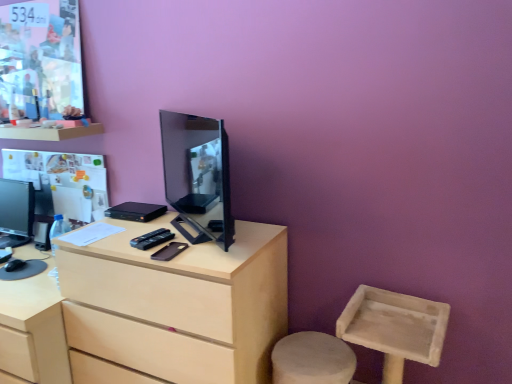
Question: Can you confirm if matte black tv at center, the second television when ordered from left to right, is thinner than black matte mobile phone at center?

Choices:
 (A) no
 (B) yes

Answer: (B)

Question: Does matte black tv at center, which is the first television in right-to-left order, have a larger size compared to black matte mobile phone at center?

Choices:
 (A) yes
 (B) no

Answer: (A)

Question: Is matte black tv at center, the second television when ordered from left to right, facing away from black matte mobile phone at center?

Choices:
 (A) yes
 (B) no

Answer: (B)

Question: Is matte black tv at center, which is the first television in right-to-left order, positioned far away from black matte mobile phone at center?

Choices:
 (A) yes
 (B) no

Answer: (B)

Question: From the image's perspective, is matte black tv at center, marked as the second television in a back-to-front arrangement, on black matte mobile phone at center?

Choices:
 (A) no
 (B) yes

Answer: (B)

Question: Based on their positions, is black plastic remote control at center located to the left or right of black matte mobile phone at center?

Choices:
 (A) right
 (B) left

Answer: (B)

Question: Is point [x=153, y=240] positioned closer to the camera than point [x=169, y=256]?

Choices:
 (A) closer
 (B) farther

Answer: (B)

Question: Looking at the image, does black plastic remote control at center seem bigger or smaller compared to black matte mobile phone at center?

Choices:
 (A) big
 (B) small

Answer: (A)

Question: From their relative heights in the image, would you say black plastic remote control at center is taller or shorter than black matte mobile phone at center?

Choices:
 (A) short
 (B) tall

Answer: (B)

Question: Based on their sizes in the image, would you say matte black tv at center, marked as the second television in a back-to-front arrangement, is bigger or smaller than light wood desk at center?

Choices:
 (A) big
 (B) small

Answer: (B)

Question: Considering the positions of matte black tv at center, arranged as the first television when viewed from the front, and light wood desk at center in the image, is matte black tv at center, arranged as the first television when viewed from the front, wider or thinner than light wood desk at center?

Choices:
 (A) wide
 (B) thin

Answer: (B)

Question: From the image's perspective, relative to light wood desk at center, is matte black tv at center, which is the first television in right-to-left order, above or below?

Choices:
 (A) below
 (B) above

Answer: (B)

Question: Considering the relative positions of matte black tv at center, the second television when ordered from left to right, and light wood desk at center in the image provided, is matte black tv at center, the second television when ordered from left to right, to the left or to the right of light wood desk at center?

Choices:
 (A) right
 (B) left

Answer: (A)

Question: Is matte paper poster at upper left situated inside black plastic remote control at center or outside?

Choices:
 (A) inside
 (B) outside

Answer: (B)

Question: From the image's perspective, relative to black plastic remote control at center, is matte paper poster at upper left above or below?

Choices:
 (A) above
 (B) below

Answer: (A)